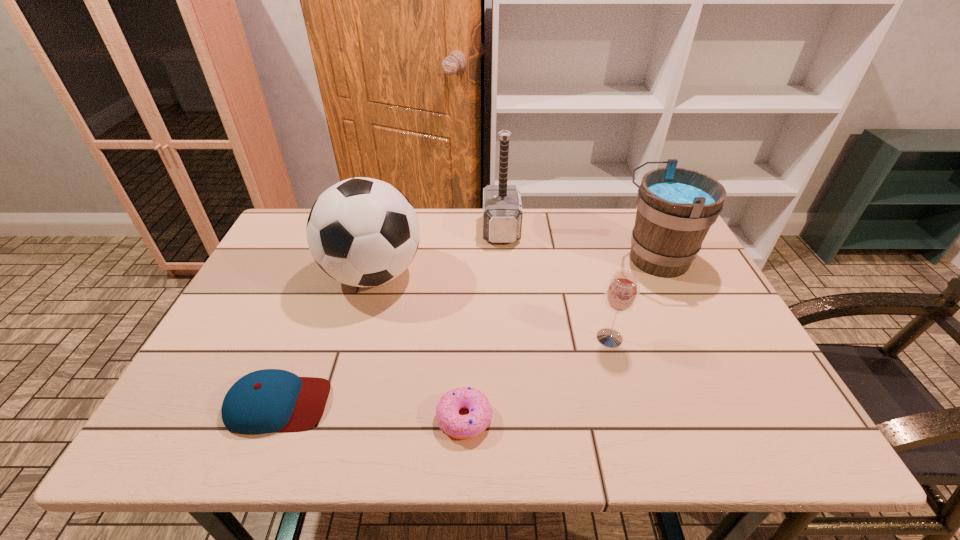
Locate an element on the screen. The image size is (960, 540). free spot between the fourth tallest object and the hammer is located at coordinates (555, 284).

In order to click on unoccupied position between the wineglass and the hammer in this screenshot , I will do click(x=555, y=284).

At what (x,y) coordinates should I click in order to perform the action: click on free space between the baseball cap and the fifth object from left to right. Please return your answer as a coordinate pair (x, y). The height and width of the screenshot is (540, 960). Looking at the image, I should click on (444, 370).

I want to click on vacant space that is in between the soccer ball and the baseball cap, so click(325, 339).

You are a GUI agent. You are given a task and a screenshot of the screen. Output one action in this format:
    pyautogui.click(x=<x>, y=<y>)
    Task: Click on the vacant area that lies between the soccer ball and the hammer
    
    Given the screenshot: What is the action you would take?
    pyautogui.click(x=437, y=252)

Image resolution: width=960 pixels, height=540 pixels. I want to click on vacant space that's between the second object from right to left and the hammer, so click(x=555, y=284).

Where is `empty space between the soccer ball and the wine bucket`? empty space between the soccer ball and the wine bucket is located at coordinates (514, 267).

At what (x,y) coordinates should I click in order to perform the action: click on vacant area that lies between the soccer ball and the shortest object. Please return your answer as a coordinate pair (x, y). The width and height of the screenshot is (960, 540). Looking at the image, I should click on (419, 346).

The image size is (960, 540). I want to click on the second closest object to the doughnut, so click(x=363, y=232).

Select which object appears as the fifth closest to the soccer ball. Please provide its 2D coordinates. Your answer should be formatted as a tuple, i.e. [(x, y)], where the tuple contains the x and y coordinates of a point satisfying the conditions above.

[(676, 207)]